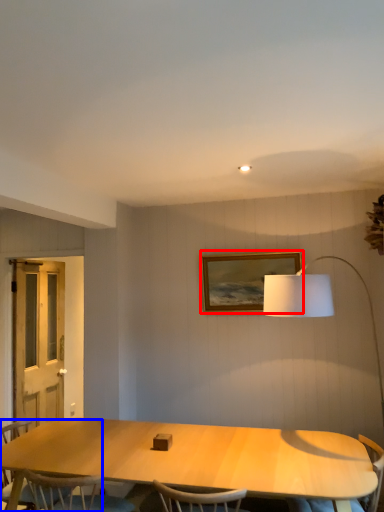
Question: Among these objects, which one is farthest to the camera, picture frame (highlighted by a red box) or chair (highlighted by a blue box)?

Choices:
 (A) picture frame
 (B) chair

Answer: (A)